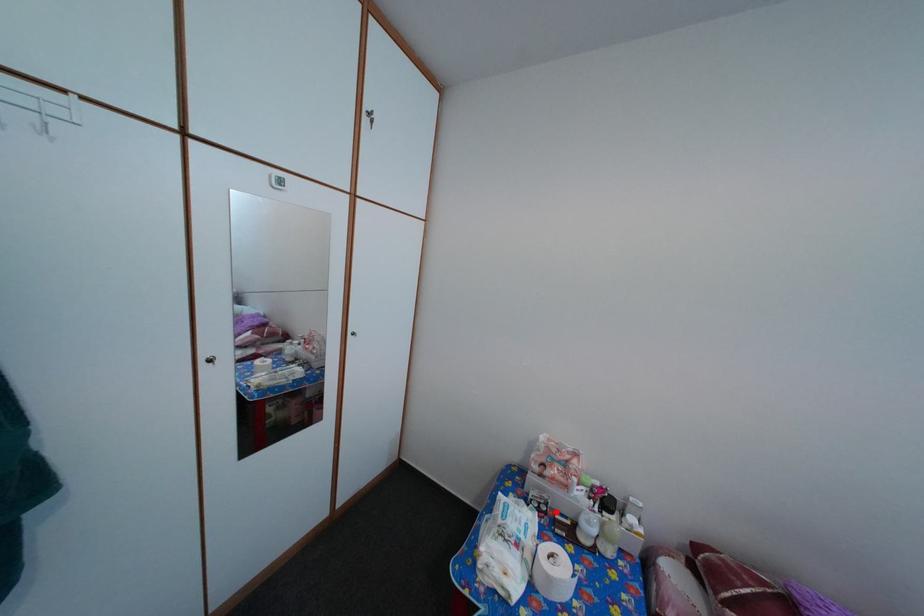
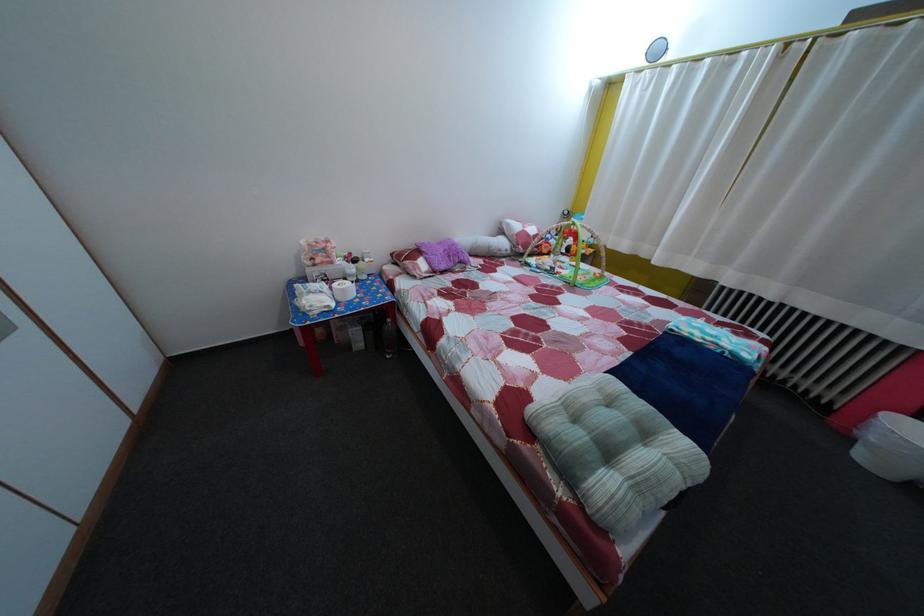
Question: A red point is marked in image1. In image2, is the corresponding 3D point closer to the camera or farther? Reply with the corresponding letter.

Choices:
 (A) The corresponding 3D point is closer.
 (B) The corresponding 3D point is farther.

Answer: (A)